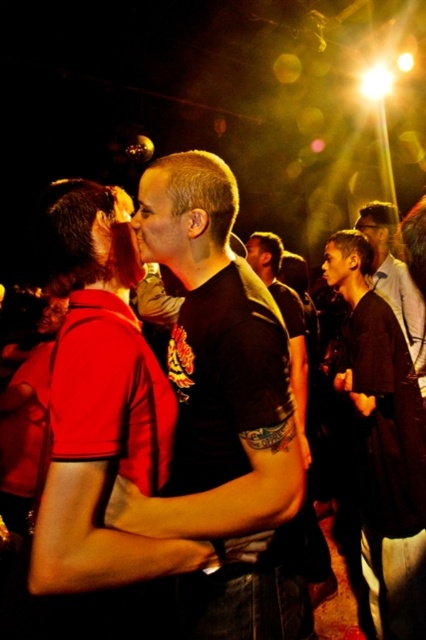
Is point (262, 509) less distant than point (425, 627)?

That is True.

Can you confirm if black matte t-shirt at center is positioned to the left of black matte shirt at center?

Yes, black matte t-shirt at center is to the left of black matte shirt at center.

In order to click on black matte t-shirt at center in this screenshot , I will do `click(227, 404)`.

This screenshot has width=426, height=640. Find the location of `black matte t-shirt at center`. black matte t-shirt at center is located at coordinates (227, 404).